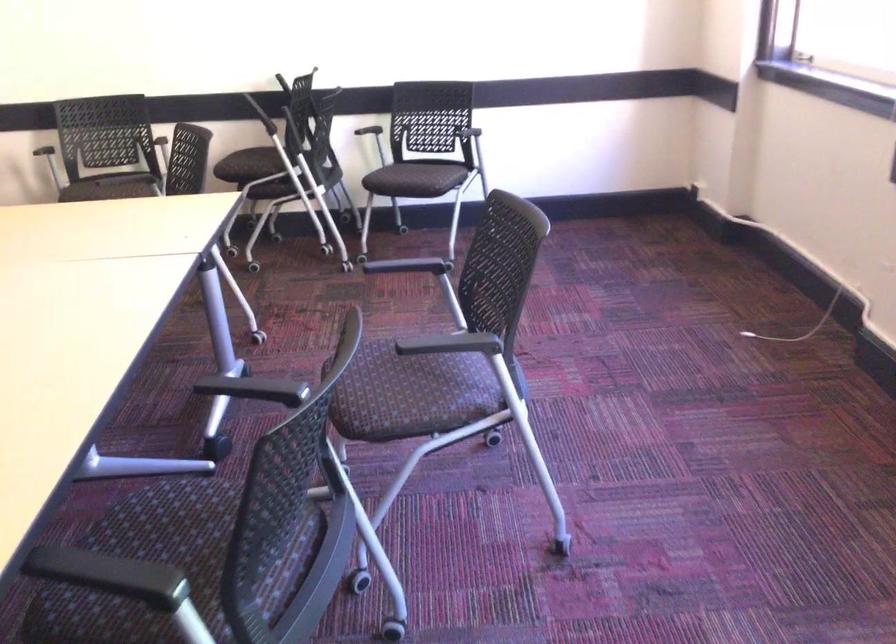
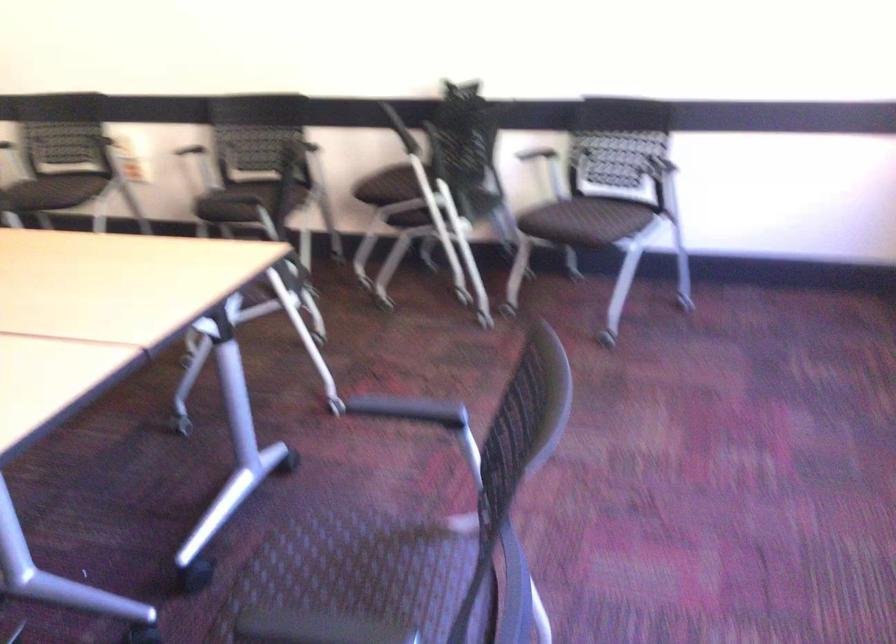
Question: The camera is either moving clockwise (left) or counter-clockwise (right) around the object. The first image is from the beginning of the video and the second image is from the end. Is the camera moving left or right when shooting the video?

Choices:
 (A) Left
 (B) Right

Answer: (B)